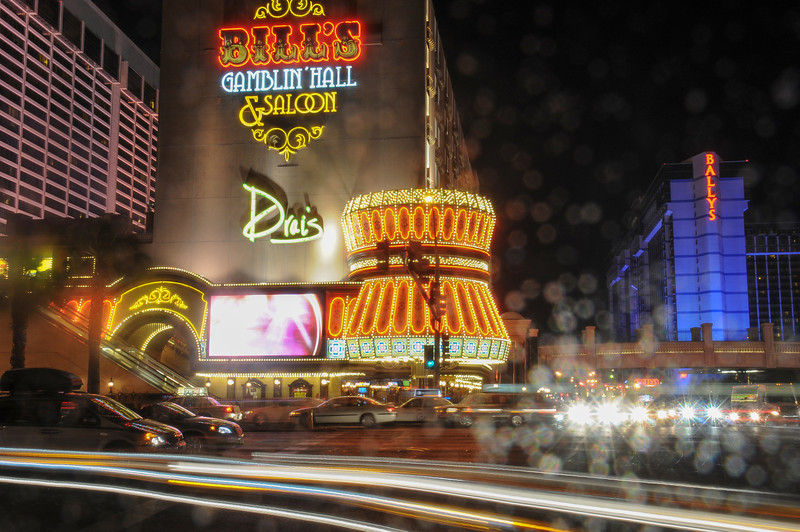
This screenshot has height=532, width=800. Identify the location of light. (582, 413).